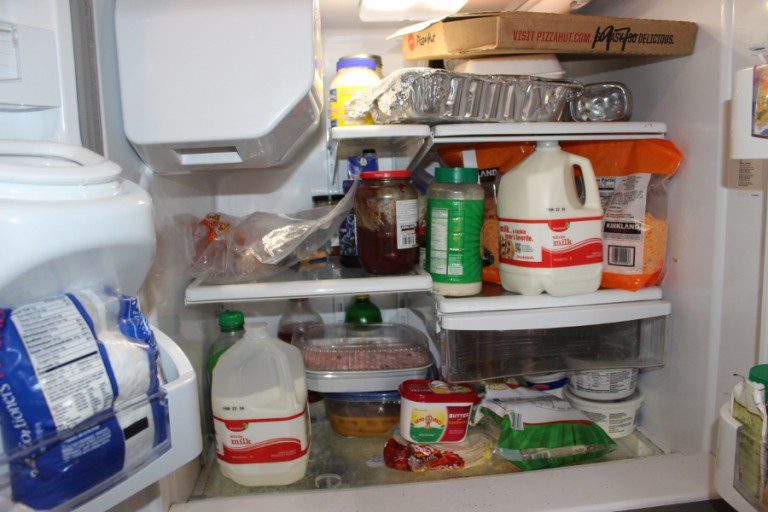
Locate an element on the screen. The height and width of the screenshot is (512, 768). fridge tray is located at coordinates (563, 317), (490, 128), (300, 287).